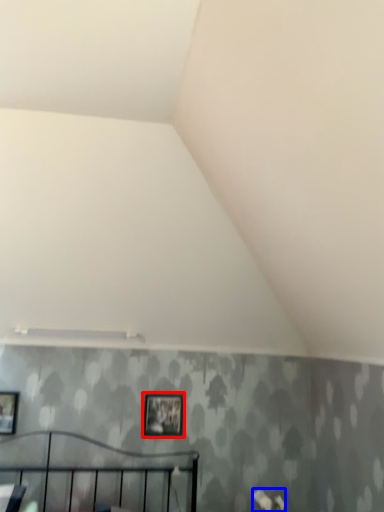
Question: Among these objects, which one is farthest to the camera, picture frame (highlighted by a red box) or flower (highlighted by a blue box)?

Choices:
 (A) picture frame
 (B) flower

Answer: (A)